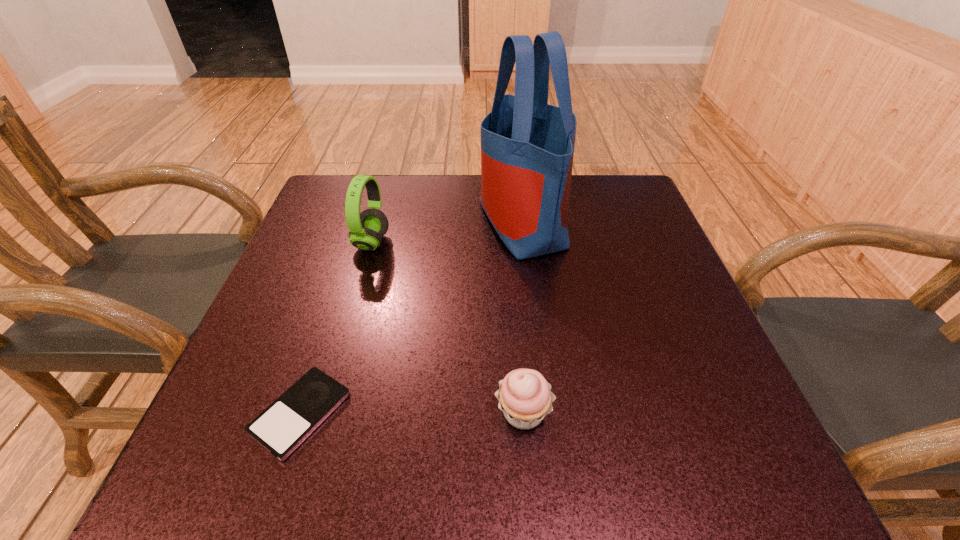
You are a GUI agent. You are given a task and a screenshot of the screen. Output one action in this format:
    pyautogui.click(x=<x>, y=<y>)
    Task: Click on the empty space that is in between the third shortest object and the shortest object
    
    Given the screenshot: What is the action you would take?
    pyautogui.click(x=336, y=328)

The image size is (960, 540). I want to click on the closest object relative to the iPod, so click(x=525, y=397).

Locate an element on the screen. The image size is (960, 540). object that can be found as the second closest to the tallest object is located at coordinates (525, 397).

Identify the location of free spot that satisfies the following two spatial constraints: 1. on the back side of the shortest object; 2. on the right side of the headset. (356, 242).

The width and height of the screenshot is (960, 540). I want to click on free spot that satisfies the following two spatial constraints: 1. on the back side of the handbag; 2. on the left side of the cupcake, so click(509, 222).

Identify the location of free region that satisfies the following two spatial constraints: 1. on the back side of the second tallest object; 2. on the left side of the iPod. (356, 242).